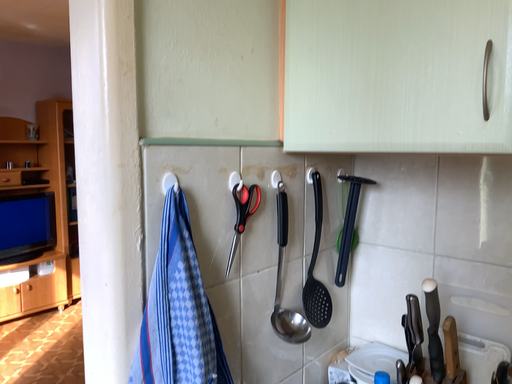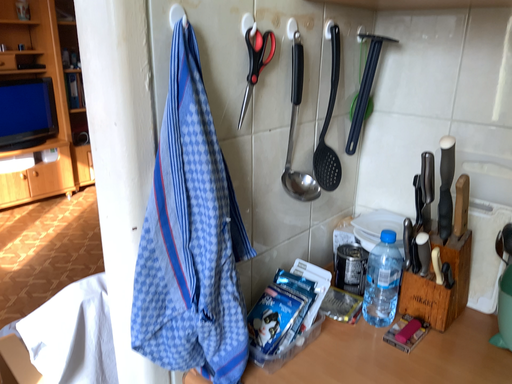
Question: How did the camera likely rotate when shooting the video?

Choices:
 (A) rotated downward
 (B) rotated upward

Answer: (A)